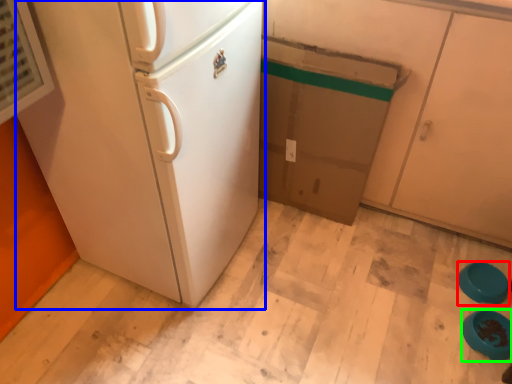
Question: Estimate the real-world distances between objects in this image. Which object is farther from appliance (highlighted by a red box), refrigerator (highlighted by a blue box) or appliance (highlighted by a green box)?

Choices:
 (A) refrigerator
 (B) appliance

Answer: (A)